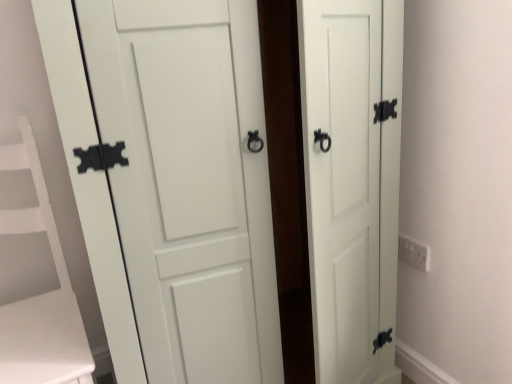
Measure the distance between white matte door at center and camera.

The depth of white matte door at center is 28.03 inches.

Where is `white plastic electric outlet at right`? This screenshot has width=512, height=384. white plastic electric outlet at right is located at coordinates (413, 253).

At what (x,y) coordinates should I click in order to perform the action: click on white matte door at center. Please return your answer as a coordinate pair (x, y). This screenshot has height=384, width=512. Looking at the image, I should click on (89, 183).

Could you tell me if white plastic electric outlet at right is facing white matte vanity at left?

Yes, white plastic electric outlet at right faces towards white matte vanity at left.

Considering the points (412, 253) and (50, 210), which point is behind, point (412, 253) or point (50, 210)?

The point (412, 253) is more distant.

In terms of height, does white plastic electric outlet at right look taller or shorter compared to white matte vanity at left?

Clearly, white plastic electric outlet at right is shorter compared to white matte vanity at left.

Which object is closer to the camera taking this photo, white matte vanity at left or white plastic electric outlet at right?

white matte vanity at left is closer to the camera.

How many degrees apart are the facing directions of white matte vanity at left and white plastic electric outlet at right?

The angular difference between white matte vanity at left and white plastic electric outlet at right is 90.9 degrees.

Between point (50, 287) and point (423, 269), which one is positioned behind?

The point (50, 287) is farther.

Is white matte door at center at the right side of white matte vanity at left?

Correct, you'll find white matte door at center to the right of white matte vanity at left.

Considering the positions of point (378, 381) and point (1, 272), is point (378, 381) closer or farther from the camera than point (1, 272)?

Point (378, 381).

From the image's perspective, is white matte door at center located above or below white matte vanity at left?

white matte door at center is situated higher than white matte vanity at left in the image.

Who is more distant, white matte door at center or white matte vanity at left?

white matte vanity at left is further from the camera.

Identify the location of vanity below the white matte door at center (from a real-world perspective). (40, 287).

Who is bigger, white matte vanity at left or white matte door at center?

white matte door at center.

Is white matte vanity at left far away from white matte door at center?

Actually, white matte vanity at left and white matte door at center are a little close together.

Which object is further away from the camera taking this photo, white matte vanity at left or white matte door at center?

white matte vanity at left is more distant.

Consider the image. Considering the sizes of white matte door at center and white plastic electric outlet at right in the image, is white matte door at center bigger or smaller than white plastic electric outlet at right?

white matte door at center is bigger than white plastic electric outlet at right.

Between white matte door at center and white plastic electric outlet at right, which one has more height?

white matte door at center.

Based on their positions, is white matte door at center located to the left or right of white plastic electric outlet at right?

From the image, it's evident that white matte door at center is to the left of white plastic electric outlet at right.

Would you say white plastic electric outlet at right is inside or outside white matte door at center?

white plastic electric outlet at right exists outside the volume of white matte door at center.

You are a GUI agent. You are given a task and a screenshot of the screen. Output one action in this format:
    pyautogui.click(x=<x>, y=<y>)
    Task: Click on the door that is on the left side of white plastic electric outlet at right
    
    Given the screenshot: What is the action you would take?
    pyautogui.click(x=89, y=183)

Considering the sizes of objects white plastic electric outlet at right and white matte door at center in the image provided, who is wider, white plastic electric outlet at right or white matte door at center?

With larger width is white matte door at center.

Is white plastic electric outlet at right closer to the viewer compared to white matte door at center?

No.

Locate an element on the screen. This screenshot has height=384, width=512. electric outlet on the right of white matte vanity at left is located at coordinates (413, 253).

Locate an element on the screen. The image size is (512, 384). vanity on the left side of white plastic electric outlet at right is located at coordinates (40, 287).

Looking at the image, which one is located further to white matte door at center, white plastic electric outlet at right or white matte vanity at left?

Based on the image, white plastic electric outlet at right appears to be further to white matte door at center.

Estimate the real-world distances between objects in this image. Which object is closer to white matte door at center, white matte vanity at left or white plastic electric outlet at right?

Among the two, white matte vanity at left is located nearer to white matte door at center.

From the image, which object appears to be nearer to white matte vanity at left, white plastic electric outlet at right or white matte door at center?

white matte door at center is positioned closer to the anchor white matte vanity at left.

Estimate the real-world distances between objects in this image. Which object is closer to white plastic electric outlet at right, white matte vanity at left or white matte door at center?

The object closer to white plastic electric outlet at right is white matte door at center.

When comparing their distances from white plastic electric outlet at right, does white matte door at center or white matte vanity at left seem further?

Among the two, white matte vanity at left is located further to white plastic electric outlet at right.

Looking at this image, estimate the real-world distances between objects in this image. Which object is further from white matte vanity at left, white matte door at center or white plastic electric outlet at right?

Among the two, white plastic electric outlet at right is located further to white matte vanity at left.

You are a GUI agent. You are given a task and a screenshot of the screen. Output one action in this format:
    pyautogui.click(x=<x>, y=<y>)
    Task: Click on the door between white matte vanity at left and white plastic electric outlet at right from left to right
    
    Given the screenshot: What is the action you would take?
    pyautogui.click(x=89, y=183)